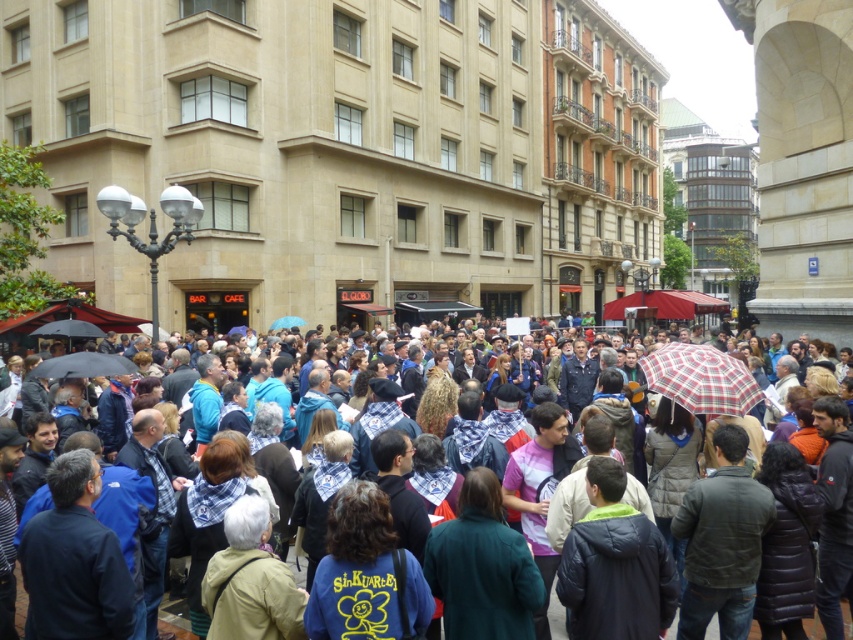
Where is `multicolored fabric bandanas at center`? multicolored fabric bandanas at center is located at coordinates (173, 618).

Is multicolored fabric bandanas at center smaller than black matte umbrella at lower left?

No, multicolored fabric bandanas at center is not smaller than black matte umbrella at lower left.

Describe the element at coordinates (173, 618) in the screenshot. This screenshot has width=853, height=640. I see `multicolored fabric bandanas at center` at that location.

Identify the location of multicolored fabric bandanas at center. (173, 618).

Describe the element at coordinates (700, 378) in the screenshot. I see `plaid fabric umbrella at center` at that location.

Who is taller, plaid fabric umbrella at center or black matte umbrella at center?

plaid fabric umbrella at center is taller.

Find the location of `plaid fabric umbrella at center`. plaid fabric umbrella at center is located at coordinates (700, 378).

At what (x,y) coordinates should I click in order to perform the action: click on plaid fabric umbrella at center. Please return your answer as a coordinate pair (x, y). This screenshot has width=853, height=640. Looking at the image, I should click on (700, 378).

Who is taller, multicolored fabric bandanas at center or black matte umbrella at center?

With more height is multicolored fabric bandanas at center.

Can you confirm if multicolored fabric bandanas at center is shorter than black matte umbrella at center?

In fact, multicolored fabric bandanas at center may be taller than black matte umbrella at center.

Is point (299, 573) less distant than point (128, 364)?

Yes.

Find the location of `multicolored fabric bandanas at center`. multicolored fabric bandanas at center is located at coordinates (173, 618).